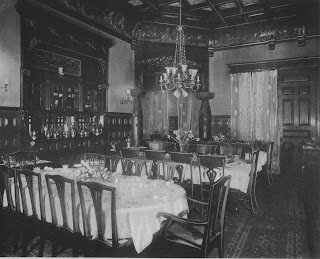
You are a GUI agent. You are given a task and a screenshot of the screen. Output one action in this format:
    pyautogui.click(x=<x>, y=<y>)
    Task: Click on the chairs
    The height and width of the screenshot is (259, 320).
    Given the screenshot: What is the action you would take?
    pyautogui.click(x=212, y=209)